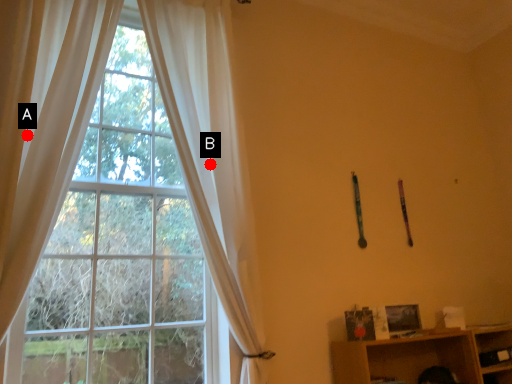
Question: Two points are circled on the image, labeled by A and B beside each circle. Which point is closer to the camera taking this photo?

Choices:
 (A) A is closer
 (B) B is closer

Answer: (A)